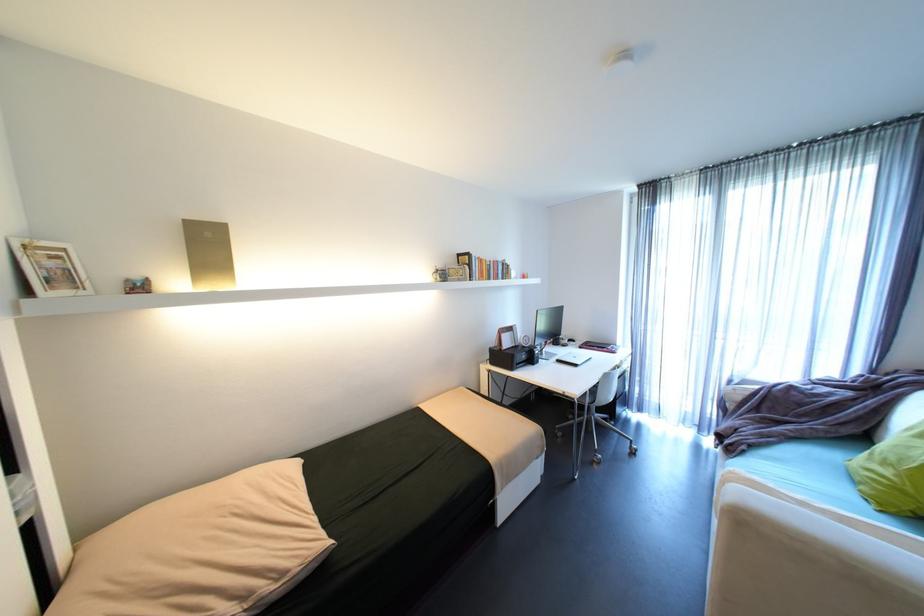
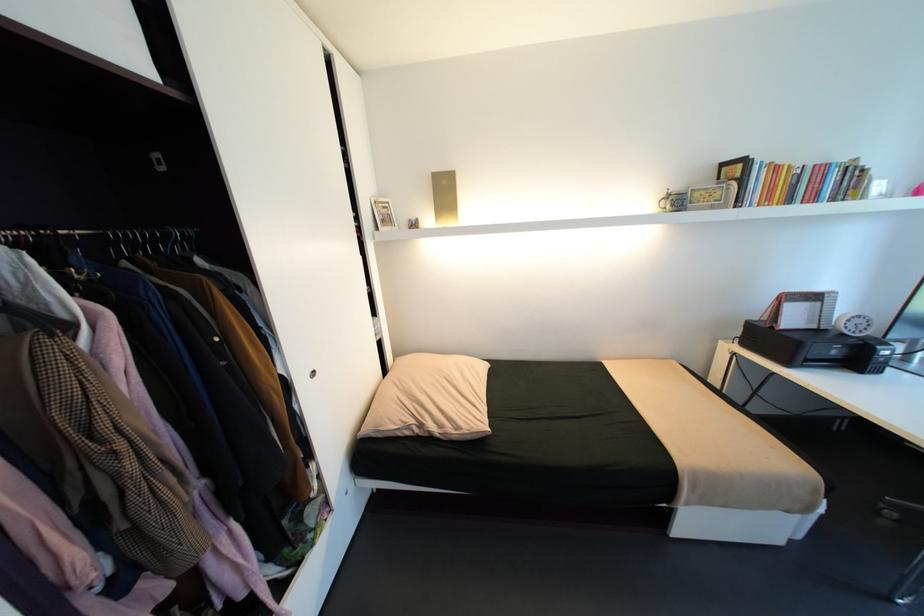
In the second image, find the point that corresponds to pixel 444 268 in the first image.

(676, 192)